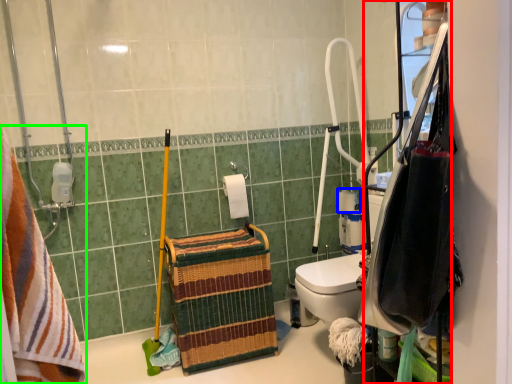
Question: Which object is the farthest from cabinetry (highlighted by a red box)? Choose among these: toilet paper (highlighted by a blue box) or towel (highlighted by a green box).

Choices:
 (A) toilet paper
 (B) towel

Answer: (A)